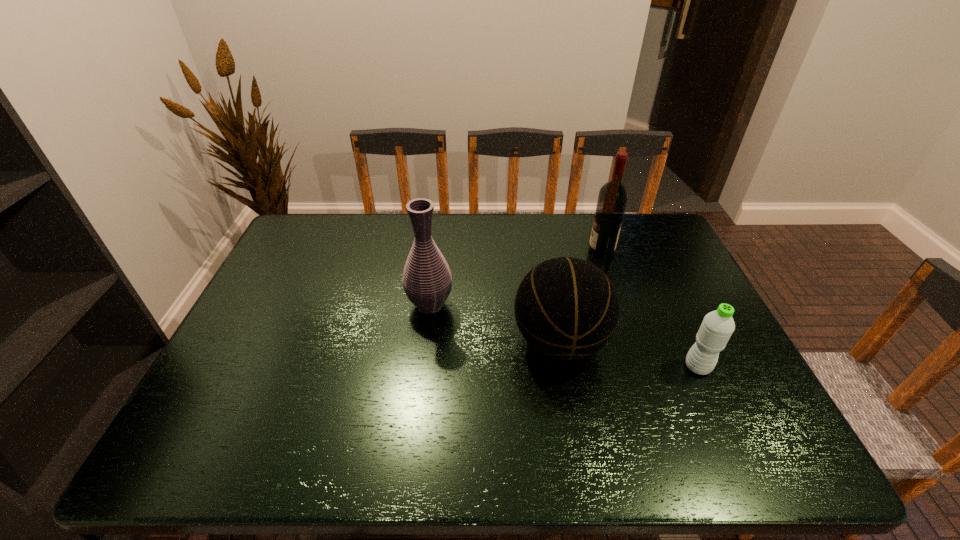
You are a GUI agent. You are given a task and a screenshot of the screen. Output one action in this format:
    pyautogui.click(x=<x>, y=<y>)
    Task: Click on the farthest object
    
    Given the screenshot: What is the action you would take?
    pyautogui.click(x=613, y=195)

Where is `the third object from left to right`? the third object from left to right is located at coordinates (613, 195).

Find the location of a particular element. This screenshot has height=540, width=960. the leftmost object is located at coordinates (427, 281).

Image resolution: width=960 pixels, height=540 pixels. I want to click on basketball, so click(566, 308).

Where is `the third object from right to left`? the third object from right to left is located at coordinates (566, 308).

Where is `the rightmost object`? the rightmost object is located at coordinates (717, 327).

The width and height of the screenshot is (960, 540). What are the coordinates of `the shortest object` in the screenshot? It's located at (717, 327).

This screenshot has width=960, height=540. What are the coordinates of `vacant area located 0.060m on the front and back of the farthest object` in the screenshot? It's located at (569, 251).

This screenshot has width=960, height=540. In order to click on vacant space situated on the front and back of the farthest object in this screenshot , I will do `click(499, 251)`.

I want to click on vacant space located 0.300m on the front and back of the farthest object, so coord(495,251).